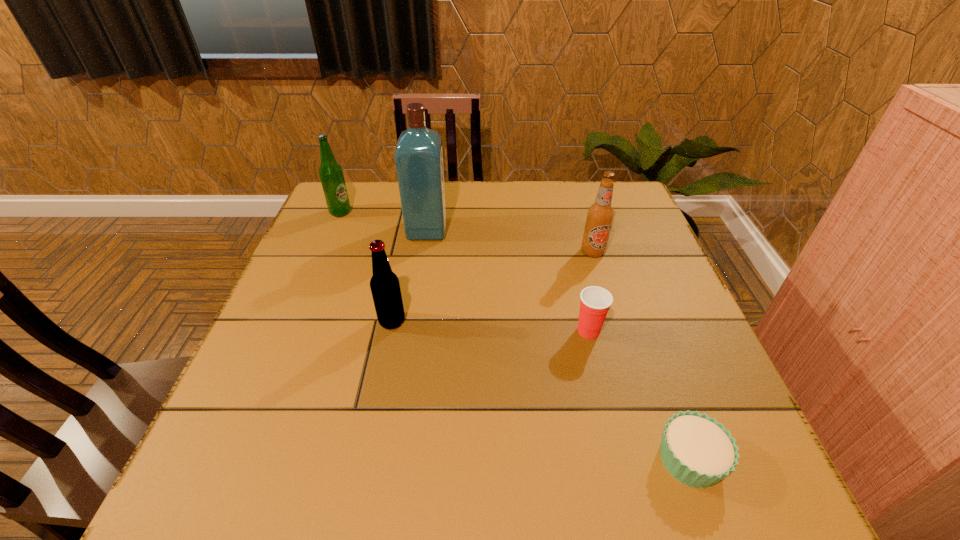
Identify the location of free space located 0.120m on the flat label side of the second farthest object. (489, 230).

Find the location of a particular element. free space located on the label of the farthest object is located at coordinates (x=412, y=212).

Find the location of `free space located 0.080m on the front label of the second farthest beer bottle`. free space located 0.080m on the front label of the second farthest beer bottle is located at coordinates (602, 280).

At what (x,y) coordinates should I click in order to perform the action: click on free space located on the front of the nearest beer bottle. Please return your answer as a coordinate pair (x, y). The image size is (960, 540). Looking at the image, I should click on (382, 373).

Locate an element on the screen. vacant space located on the front of the Dixie cup is located at coordinates (610, 418).

Identify the location of vacant region located on the left of the nearest object. The height and width of the screenshot is (540, 960). (452, 459).

Where is `liquor located at the far edge`? This screenshot has width=960, height=540. liquor located at the far edge is located at coordinates (419, 153).

The width and height of the screenshot is (960, 540). Find the location of `beer bottle that is at the far edge`. beer bottle that is at the far edge is located at coordinates [331, 175].

Where is `object at the near edge`? The height and width of the screenshot is (540, 960). object at the near edge is located at coordinates (697, 450).

Locate an element on the screen. object at the left edge is located at coordinates (331, 175).